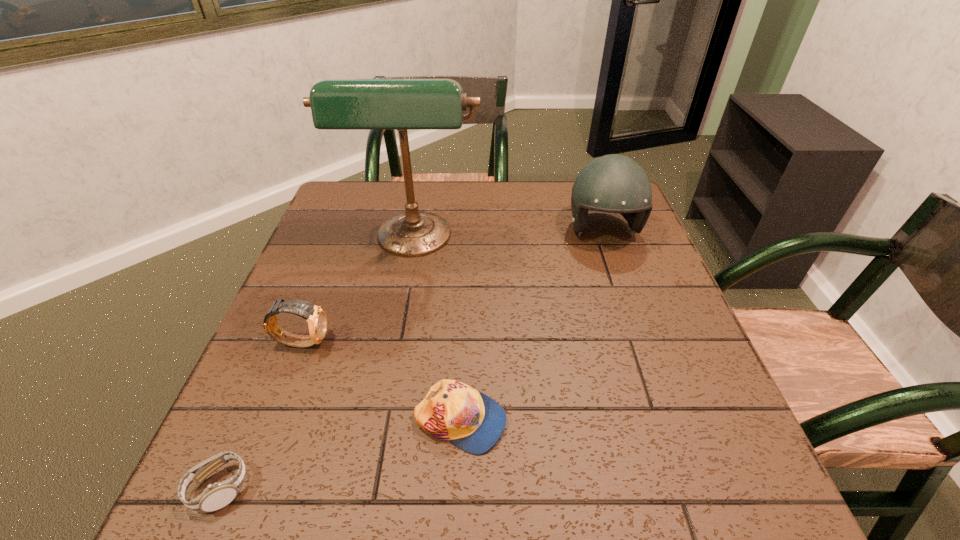
You are a GUI agent. You are given a task and a screenshot of the screen. Output one action in this format:
    pyautogui.click(x=<x>, y=<y>)
    Task: Click on the table lamp
    
    Given the screenshot: What is the action you would take?
    pyautogui.click(x=338, y=104)

Locate an element on the screen. The image size is (960, 540). the second tallest object is located at coordinates point(613,183).

Where is `football helmet`? football helmet is located at coordinates (613, 183).

Locate an element on the screen. the third nearest object is located at coordinates (316, 317).

This screenshot has height=540, width=960. I want to click on the third tallest object, so click(x=316, y=317).

Where is `cap`? cap is located at coordinates (454, 411).

At what (x,y) coordinates should I click in order to perform the action: click on the nearest object. Please return your answer as a coordinate pair (x, y). Looking at the image, I should click on (216, 496).

This screenshot has height=540, width=960. Find the location of `the shorter watch`. the shorter watch is located at coordinates (216, 496).

Locate an element on the screen. blank space located 0.190m above the green lampshade of the tallest object is located at coordinates (397, 332).

Identify the location of free space located 0.240m at the face opening of the rightmost object. (636, 326).